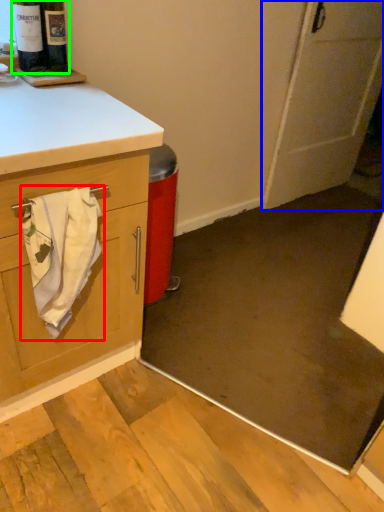
Question: Which is farther away from bath towel (highlighted by a red box)? door (highlighted by a blue box) or beer bottle (highlighted by a green box)?

Choices:
 (A) door
 (B) beer bottle

Answer: (A)